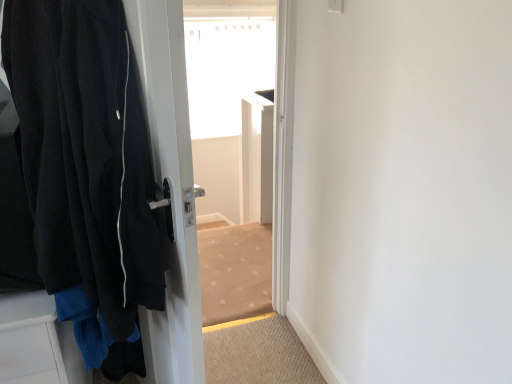
Locate an element on the screen. This screenshot has width=512, height=384. black fleece jacket at left is located at coordinates (172, 189).

Describe the element at coordinates (172, 189) in the screenshot. I see `black fleece jacket at left` at that location.

Find the location of `black fleece jacket at left`. black fleece jacket at left is located at coordinates (172, 189).